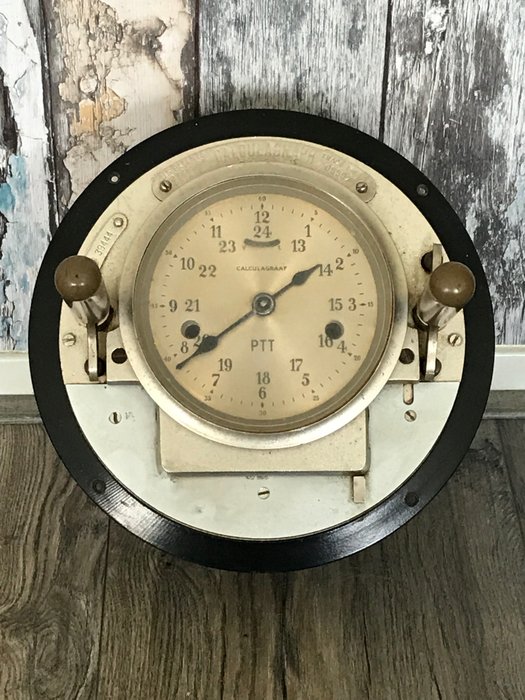
Identify the location of clock. (294, 316).